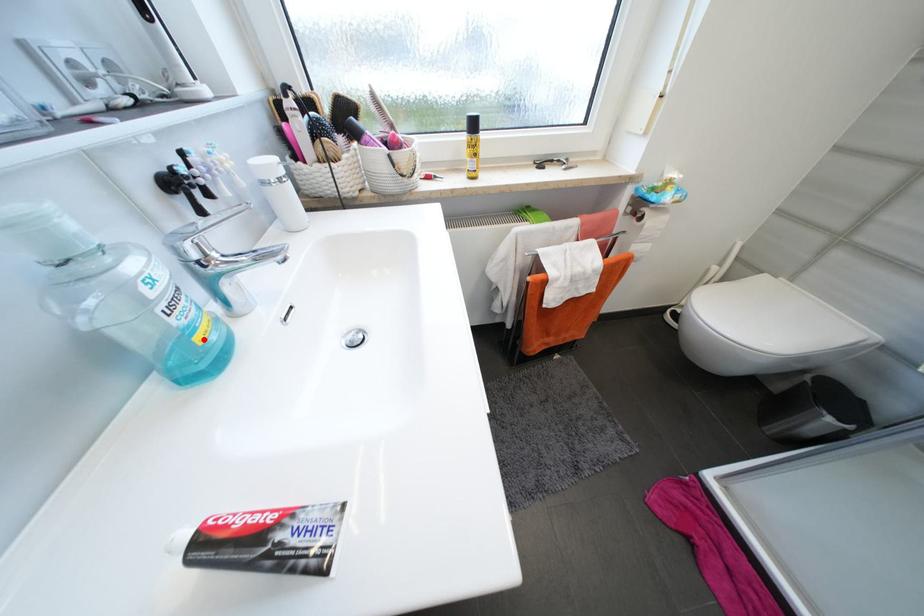
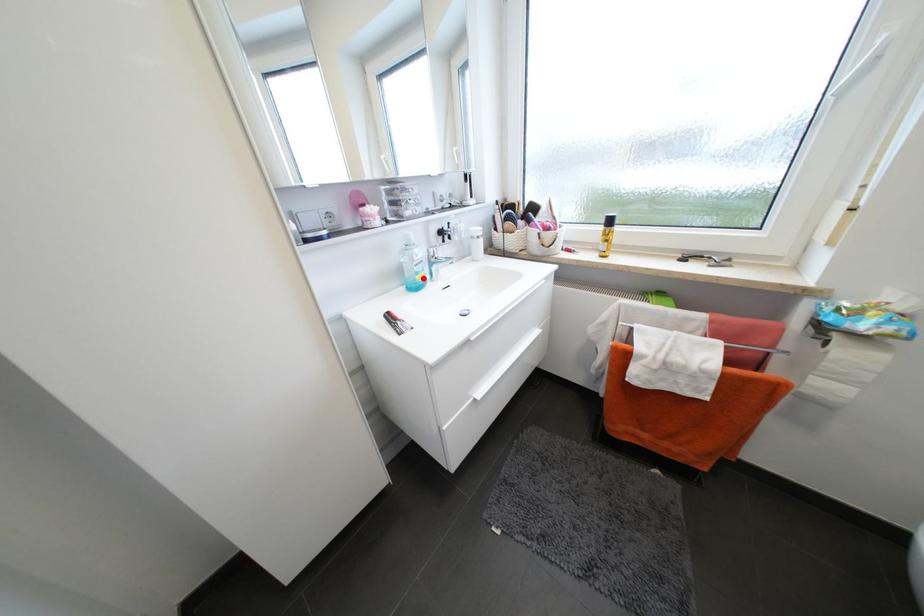
I am providing you with two images of the same scene from different viewpoints. A red point is marked on the first image and another point is marked on the second image. Does the point marked in image1 correspond to the same location as the one in image2?

Yes